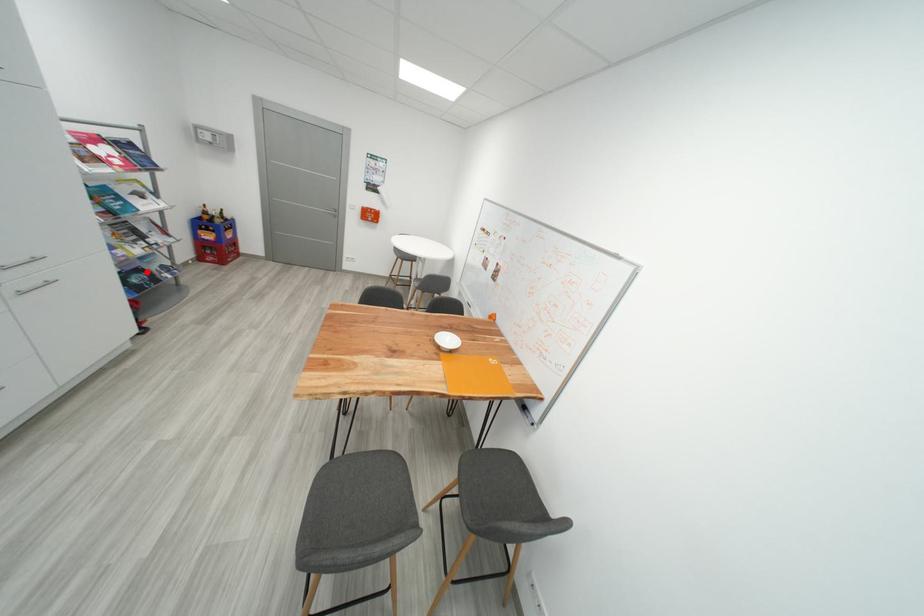
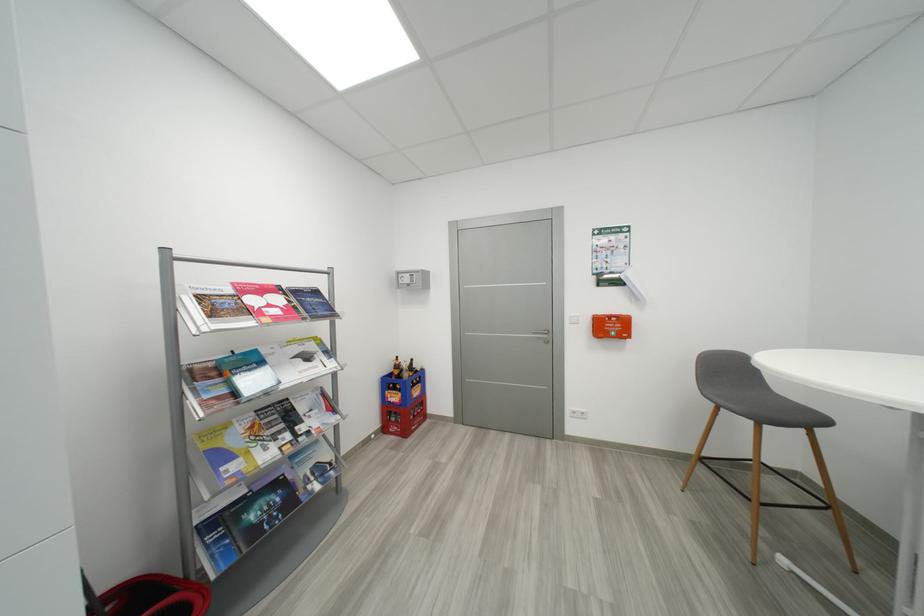
Where in the second image is the point corresponding to the highlighted location from the first image?

(285, 485)